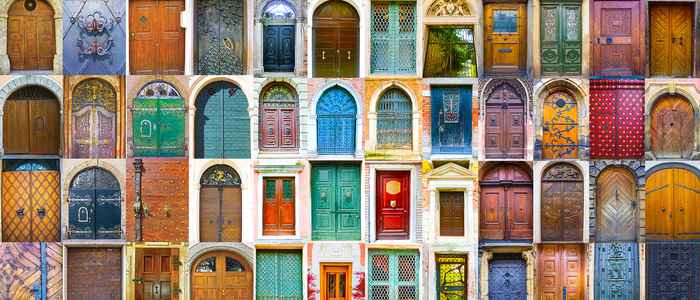
Where is `green doors`? The width and height of the screenshot is (700, 300). green doors is located at coordinates (148, 127), (220, 114), (323, 203), (287, 271), (392, 272), (386, 49), (570, 27).